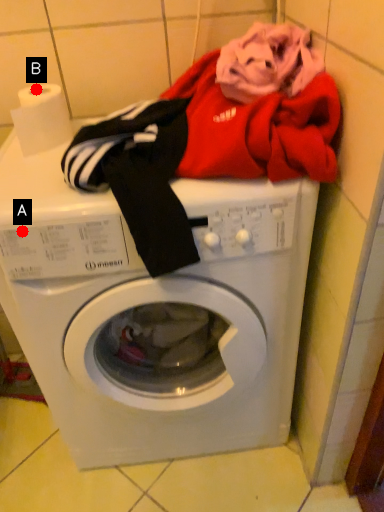
Question: Two points are circled on the image, labeled by A and B beside each circle. Which point is closer to the camera taking this photo?

Choices:
 (A) A is closer
 (B) B is closer

Answer: (A)